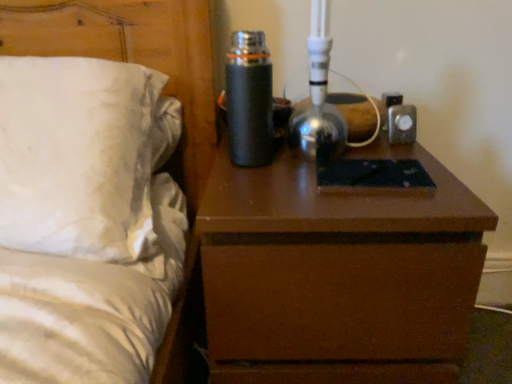
Image resolution: width=512 pixels, height=384 pixels. I want to click on unoccupied area in front of black matte thermos at upper center, so click(271, 185).